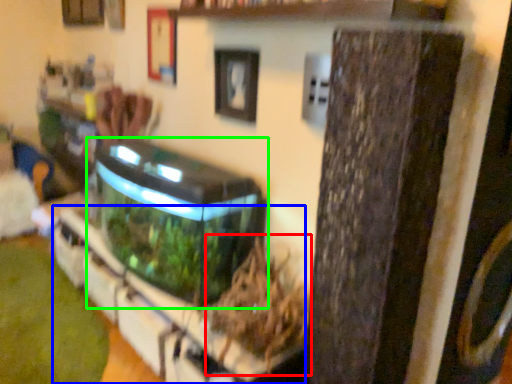
Question: Which object is positioned closest to plant (highlighted by a red box)? Select from shelf (highlighted by a blue box) and water tank (highlighted by a green box).

Choices:
 (A) shelf
 (B) water tank

Answer: (A)